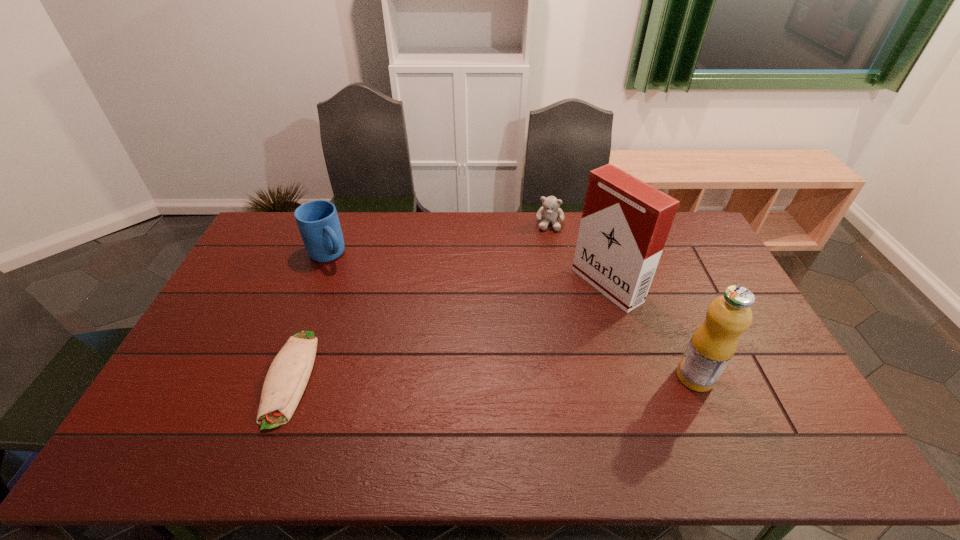
Image resolution: width=960 pixels, height=540 pixels. Find the location of `vacant space on the desktop that is between the shortest object and the second tallest object and is positioned on the side of the third tallest object with the handle`. vacant space on the desktop that is between the shortest object and the second tallest object and is positioned on the side of the third tallest object with the handle is located at coordinates (444, 377).

The image size is (960, 540). I want to click on free space on the desktop that is between the burrito and the rightmost object and is positioned on the front-facing side of the tallest object, so click(444, 377).

The height and width of the screenshot is (540, 960). I want to click on free space on the desktop that is between the shortest object and the second tallest object and is positioned on the face of the teddy bear, so click(x=532, y=377).